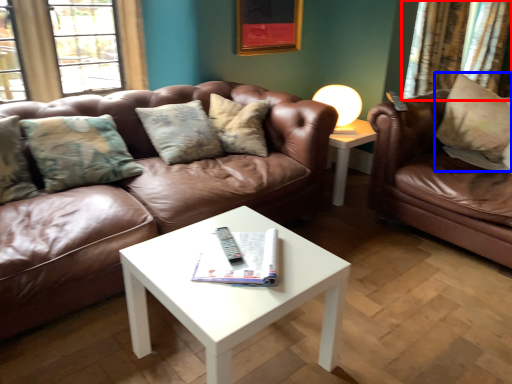
Question: Which object is closer to the camera taking this photo, curtain (highlighted by a red box) or pillow (highlighted by a blue box)?

Choices:
 (A) curtain
 (B) pillow

Answer: (B)